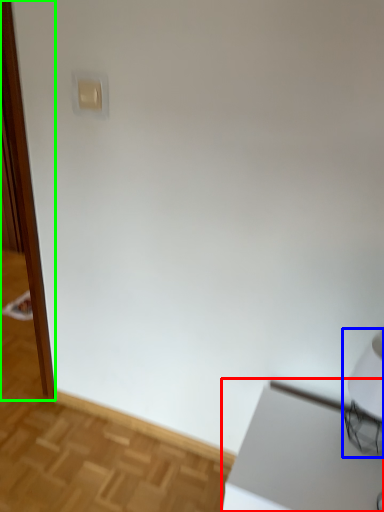
Question: Estimate the real-world distances between objects in this image. Which object is farther from table (highlighted by a red box), table lamp (highlighted by a blue box) or screen door (highlighted by a green box)?

Choices:
 (A) table lamp
 (B) screen door

Answer: (B)